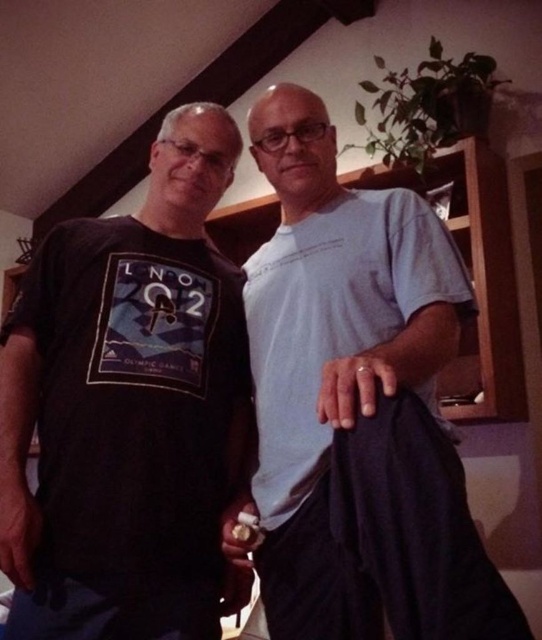
Question: Is the position of black matte t-shirt at left less distant than that of light blue cotton t-shirt at center?

Choices:
 (A) no
 (B) yes

Answer: (A)

Question: Which of the following is the farthest from the observer?

Choices:
 (A) (300, 289)
 (B) (234, 333)

Answer: (B)

Question: Where is black matte t-shirt at left located in relation to light blue cotton t-shirt at center in the image?

Choices:
 (A) right
 (B) left

Answer: (B)

Question: Does black matte t-shirt at left appear on the right side of light blue cotton t-shirt at center?

Choices:
 (A) yes
 (B) no

Answer: (B)

Question: Which object appears farthest from the camera in this image?

Choices:
 (A) light blue cotton t-shirt at center
 (B) black matte t-shirt at left

Answer: (B)